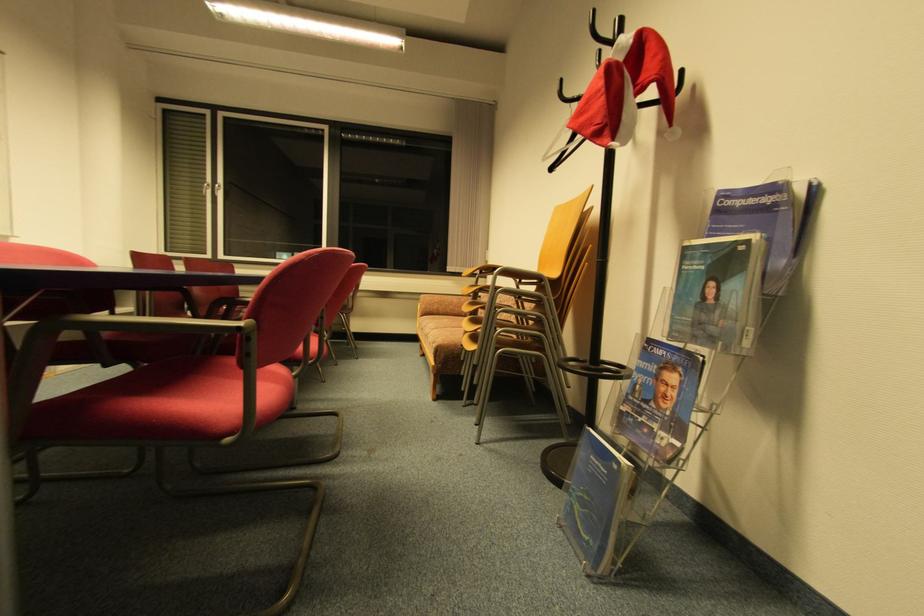
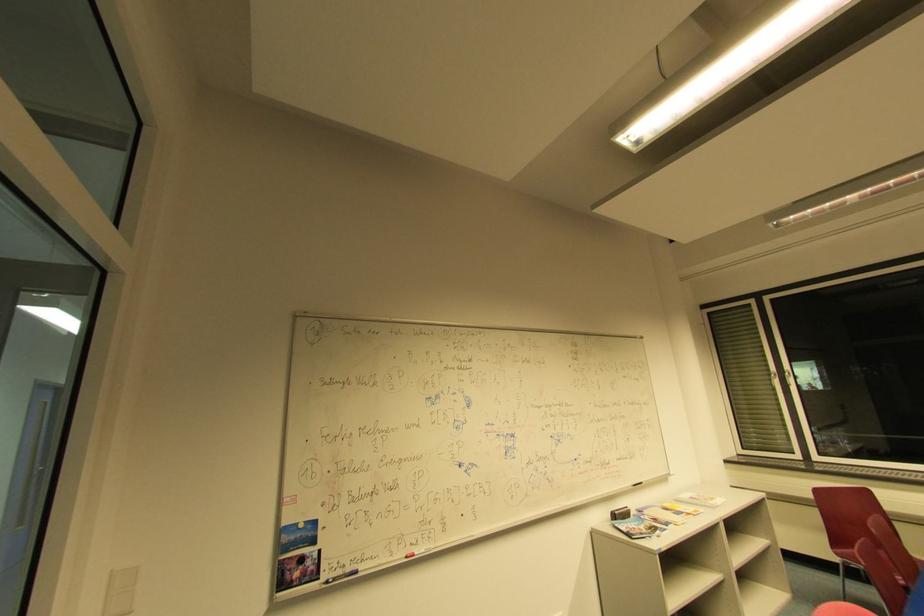
The point at [223,187] is marked in the first image. Where is the corresponding point in the second image?

(791, 375)